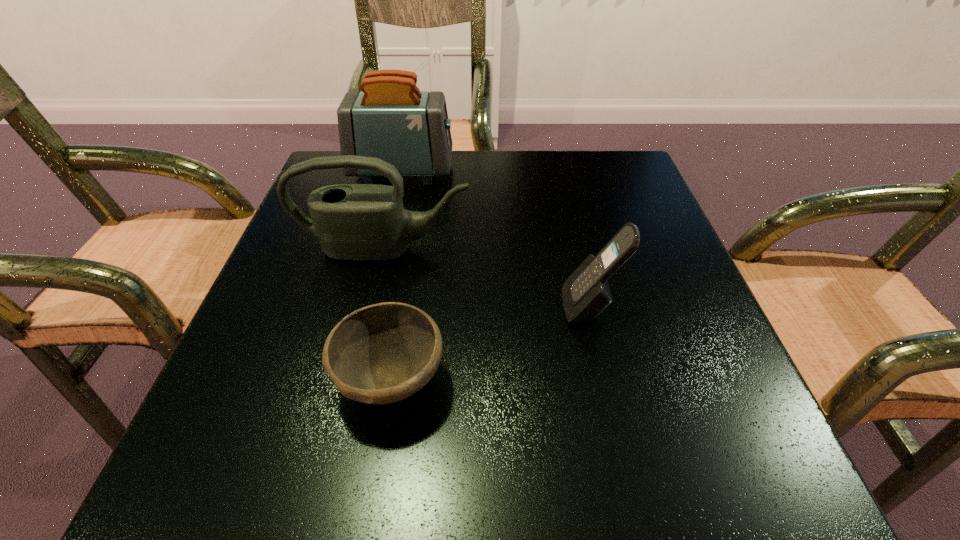
At what (x,y) coordinates should I click in order to perform the action: click on vacant space at the left edge of the desktop. Please return your answer as a coordinate pair (x, y). Image resolution: width=960 pixels, height=540 pixels. Looking at the image, I should click on (280, 352).

Identify the location of vacant space at the right edge of the desktop. (714, 412).

In the image, there is a desktop. Identify the location of vacant region at the near left corner. This screenshot has height=540, width=960. (298, 494).

Image resolution: width=960 pixels, height=540 pixels. In the image, there is a desktop. Find the location of `vacant area at the far right corner`. vacant area at the far right corner is located at coordinates (586, 184).

Locate an element on the screen. The height and width of the screenshot is (540, 960). free space at the near right corner is located at coordinates (694, 442).

Locate an element on the screen. Image resolution: width=960 pixels, height=540 pixels. free space between the third farthest object and the toaster is located at coordinates (496, 239).

At what (x,y) coordinates should I click in order to perform the action: click on empty space between the rightmost object and the farthest object. Please return your answer as a coordinate pair (x, y). This screenshot has width=960, height=540. Looking at the image, I should click on (496, 239).

Identify the location of free space between the shortest object and the rightmost object. This screenshot has width=960, height=540. (491, 344).

The image size is (960, 540). I want to click on free space between the farthest object and the nearest object, so click(x=396, y=276).

Locate an element on the screen. The image size is (960, 540). vacant area that lies between the bowl and the toaster is located at coordinates (396, 276).